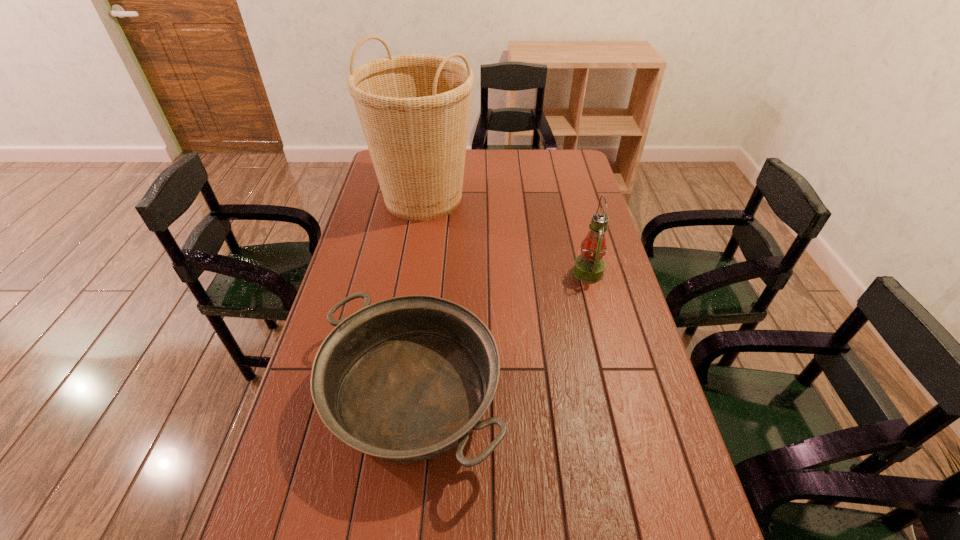
What are the coordinates of `the farthest object` in the screenshot? It's located at (414, 109).

This screenshot has width=960, height=540. Identify the location of the tallest object. (414, 109).

Locate an element on the screen. the rightmost object is located at coordinates (589, 267).

Identify the location of the second tallest object. This screenshot has height=540, width=960. (589, 267).

Locate an element on the screen. pan is located at coordinates (406, 379).

The height and width of the screenshot is (540, 960). Identify the location of the nearest object. (406, 379).

This screenshot has height=540, width=960. What are the coordinates of `free location located on the right of the basket` in the screenshot? It's located at (535, 198).

Identify the location of free spot located 0.250m on the left of the second shortest object. This screenshot has height=540, width=960. (497, 272).

This screenshot has height=540, width=960. I want to click on vacant space located on the back of the pan, so click(431, 248).

I want to click on object at the far edge, so click(414, 109).